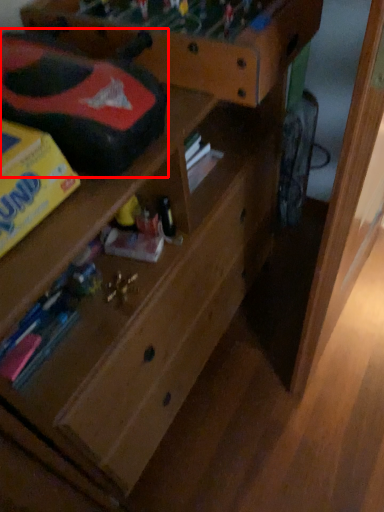
Question: Where is toy car (annotated by the red box) located in relation to shelf in the image?

Choices:
 (A) right
 (B) left

Answer: (B)